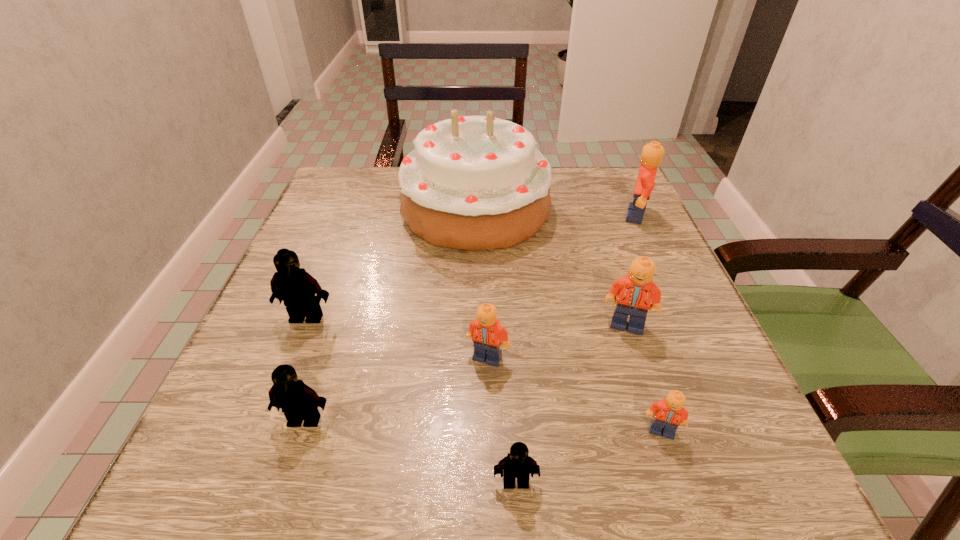
I want to click on cake that is at the far edge, so click(475, 183).

Where is `Lego at the far edge`? Lego at the far edge is located at coordinates [x=652, y=153].

The height and width of the screenshot is (540, 960). Find the location of `object at the far right corner`. object at the far right corner is located at coordinates pos(652,153).

The height and width of the screenshot is (540, 960). Find the location of `object at the near right corner`. object at the near right corner is located at coordinates (669, 413).

The width and height of the screenshot is (960, 540). In the image, there is a desktop. In order to click on free space at the far edge in this screenshot , I will do click(398, 169).

Identify the location of free region at the left edge. (272, 319).

Find the location of a particular element. The height and width of the screenshot is (540, 960). vacant space at the right edge is located at coordinates (656, 362).

Find the location of a particular element. vacant area at the far left corner of the desktop is located at coordinates (314, 208).

You are a GUI agent. You are given a task and a screenshot of the screen. Output one action in this format:
    pyautogui.click(x=<x>, y=<y>)
    Task: Click on the vacant space at the near left corner
    The width and height of the screenshot is (960, 540).
    Given the screenshot: What is the action you would take?
    pyautogui.click(x=208, y=503)

Locate an element on the screen. The width and height of the screenshot is (960, 540). free space at the far right corner of the desktop is located at coordinates (599, 178).